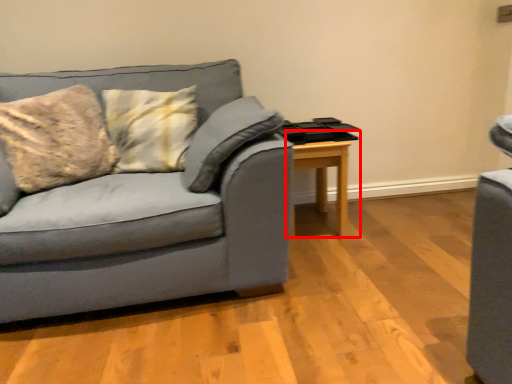
Question: From the image, what is the correct spatial relationship of table (annotated by the red box) in relation to studio couch?

Choices:
 (A) right
 (B) left

Answer: (A)